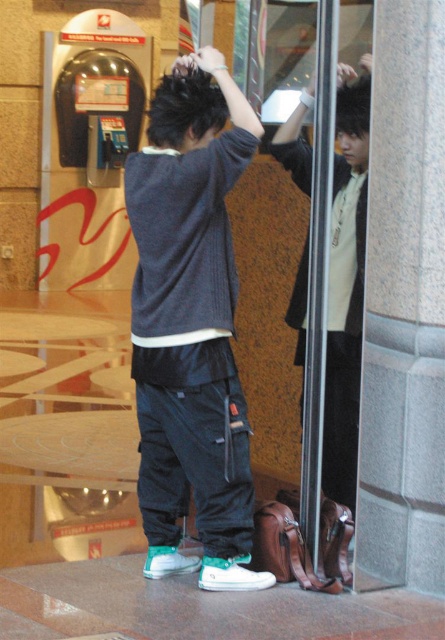
You are standing in a shopping mall and see the dark gray sweater at center. If you want to take a photo of it with your phone, which is 6 feet away from you, will you be able to capture the entire sweater in the frame without moving closer?

The dark gray sweater at center is 10.95 feet away from the camera. Since your phone is 6 feet away from you, the total distance between the sweater and your phone would be 10.95 minus 6 equals 4.95 feet. At this distance, it depends on your phone camera lens and zoom capabilities, but generally, capturing the entire sweater might be challenging as it requires a wide enough angle. However, without specific camera details, we can only confirm the distance is 4.95 feet between the sweater and your phone.

You are a fashion designer observing the image. You need to determine if the two garments, the dark gray sweater at center and the matte black jacket at center, can be displayed side by side on a 36 inch wide mannequin. Can they fit without overlapping?

The dark gray sweater at center and the matte black jacket at center are 33.40 inches apart from each other. Since the mannequin is 36 inches wide, there is enough space to display both garments side by side without overlapping.